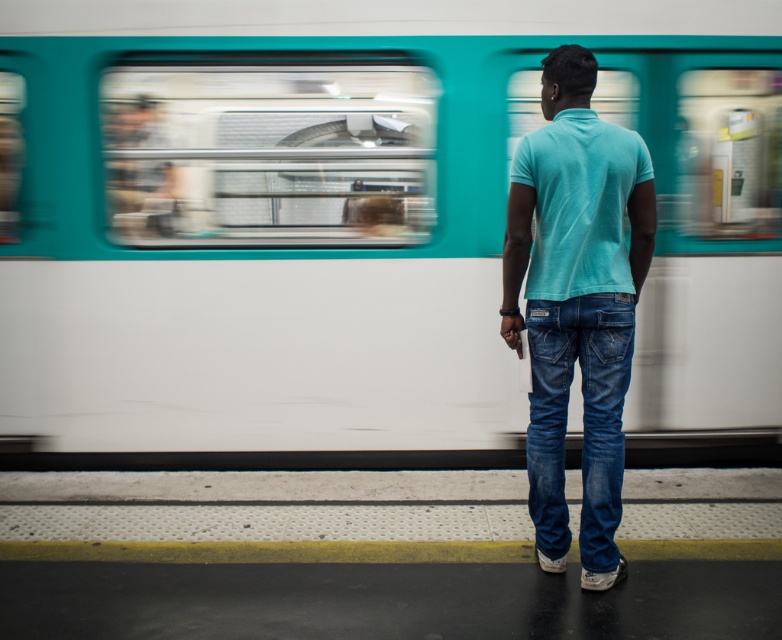
Question: Is light blue cotton shirt at center below turquoise cotton polo at center?

Choices:
 (A) yes
 (B) no

Answer: (A)

Question: Which object is closer to the camera taking this photo?

Choices:
 (A) denim jeans at center
 (B) light blue cotton shirt at center

Answer: (B)

Question: Is teal glossy train at center closer to the viewer compared to turquoise cotton polo at center?

Choices:
 (A) no
 (B) yes

Answer: (A)

Question: Among these points, which one is nearest to the camera?

Choices:
 (A) (336, 339)
 (B) (619, 323)
 (C) (540, 356)

Answer: (B)

Question: Among these objects, which one is nearest to the camera?

Choices:
 (A) light blue cotton shirt at center
 (B) teal glossy train at center
 (C) turquoise cotton polo at center
 (D) denim jeans at center

Answer: (C)

Question: Can you confirm if light blue cotton shirt at center is positioned above turquoise cotton polo at center?

Choices:
 (A) yes
 (B) no

Answer: (B)